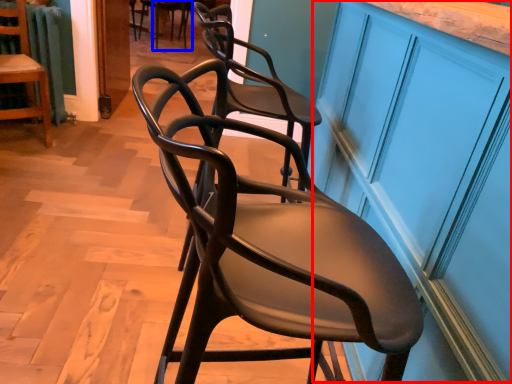
Question: Which object is further to the camera taking this photo, cabinetry (highlighted by a red box) or chair (highlighted by a blue box)?

Choices:
 (A) cabinetry
 (B) chair

Answer: (B)